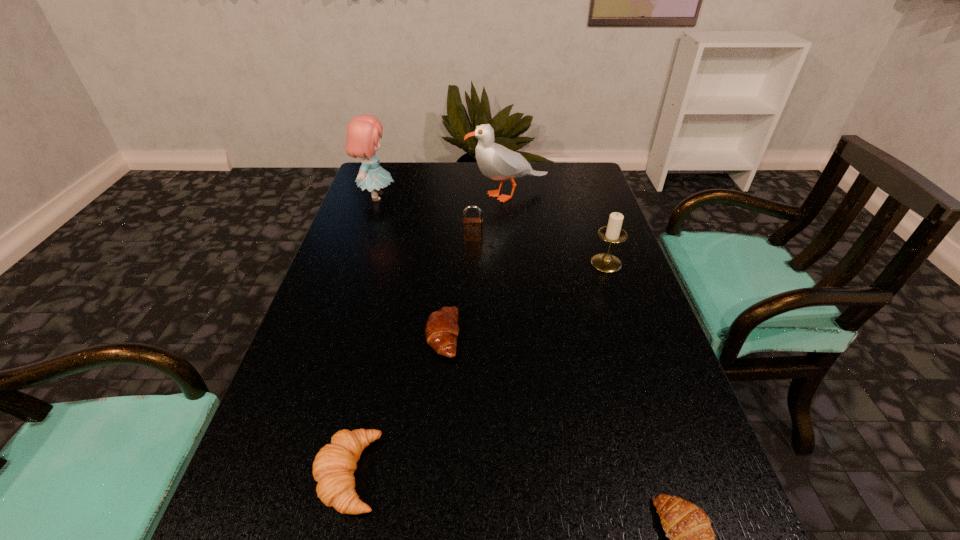
The width and height of the screenshot is (960, 540). I want to click on free space that is in between the padlock and the fifth farthest object, so click(458, 287).

Locate an element on the screen. This screenshot has width=960, height=540. vacant space that is in between the doll and the fifth nearest object is located at coordinates (424, 218).

This screenshot has height=540, width=960. What are the coordinates of `free space between the farthest crescent roll and the gull` in the screenshot? It's located at (475, 265).

Where is `free point between the farthest crescent roll and the gull`? This screenshot has height=540, width=960. free point between the farthest crescent roll and the gull is located at coordinates (475, 265).

I want to click on empty space that is in between the tallest crescent roll and the second crescent roll from right to left, so click(x=396, y=404).

What are the coordinates of `object that stands as the second closest to the gull` in the screenshot? It's located at (363, 132).

This screenshot has height=540, width=960. In order to click on object that stands as the second closest to the rightmost crescent roll in this screenshot , I will do tap(333, 468).

Locate an element on the screen. The height and width of the screenshot is (540, 960). crescent roll that is the second nearest to the rightmost crescent roll is located at coordinates (333, 468).

Choose which crescent roll is the second nearest neighbor to the gull. Please provide its 2D coordinates. Your answer should be formatted as a tuple, i.e. [(x, y)], where the tuple contains the x and y coordinates of a point satisfying the conditions above.

[(333, 468)]

This screenshot has height=540, width=960. Find the location of `vacant position in the image that satisfies the following two spatial constraints: 1. on the front-facing side of the tallest crescent roll; 2. on the left side of the doll`. vacant position in the image that satisfies the following two spatial constraints: 1. on the front-facing side of the tallest crescent roll; 2. on the left side of the doll is located at coordinates (281, 474).